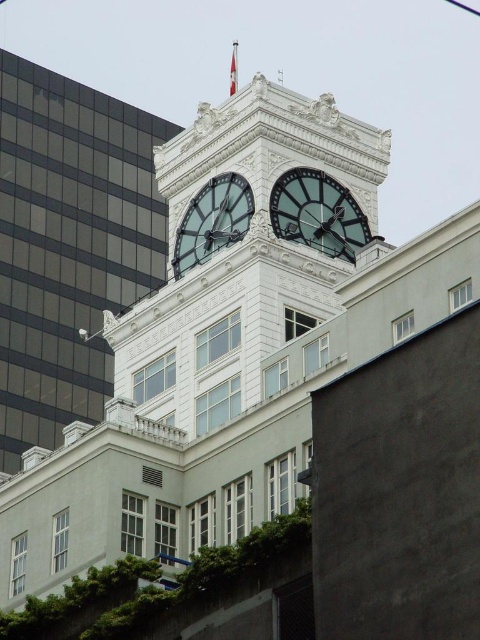
You are a maintenance worker needing to inspect both the polished brass clock at upper center and the matte glass clock at upper center. Given that your ladder can reach up to 5 meters, can you safely access both clocks using the same ladder?

The distance between the polished brass clock at upper center and the matte glass clock at upper center is 4.87 meters, so yes, the ladder can safely reach both clocks as the distance is within its 5 meter capacity.

You are standing at the entrance of the building and want to take a photo of the white marble clock tower at upper center. To ensure the clock tower is centered in your photo, where should you position yourself relative to the building?

The white marble clock tower at upper center is located at point 0.567 on the x axis and 0.425 on the y axis, so you should position yourself directly in front of the building at the center to ensure the clock tower is centered in your photo.